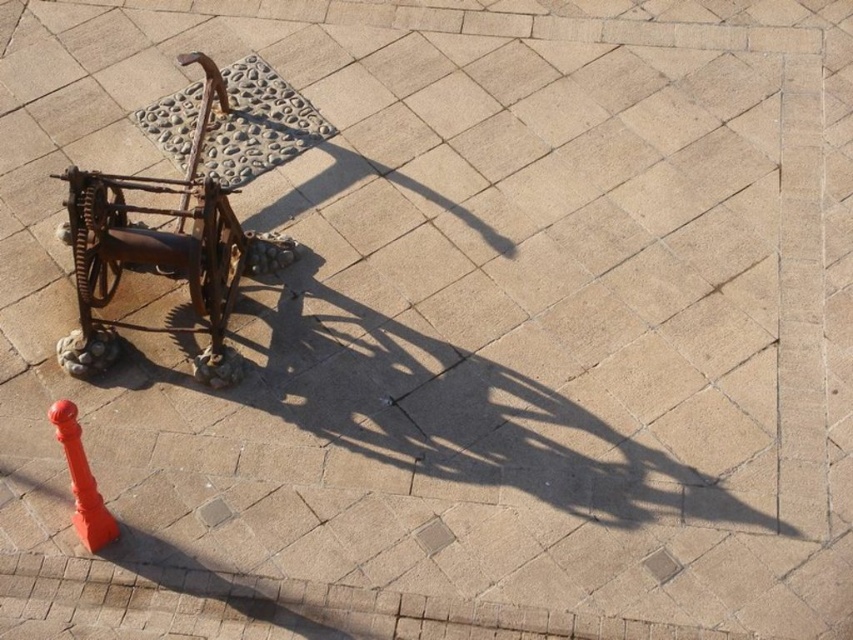
In the scene shown: Is rusty metal baby carriage at center wider than orange matte traffic cone at lower left?

Indeed, rusty metal baby carriage at center has a greater width compared to orange matte traffic cone at lower left.

Which is above, rusty metal baby carriage at center or orange matte traffic cone at lower left?

Positioned higher is rusty metal baby carriage at center.

Measure the distance between point (195,369) and camera.

They are 6.38 meters apart.

Locate an element on the screen. The image size is (853, 640). rusty metal baby carriage at center is located at coordinates (161, 250).